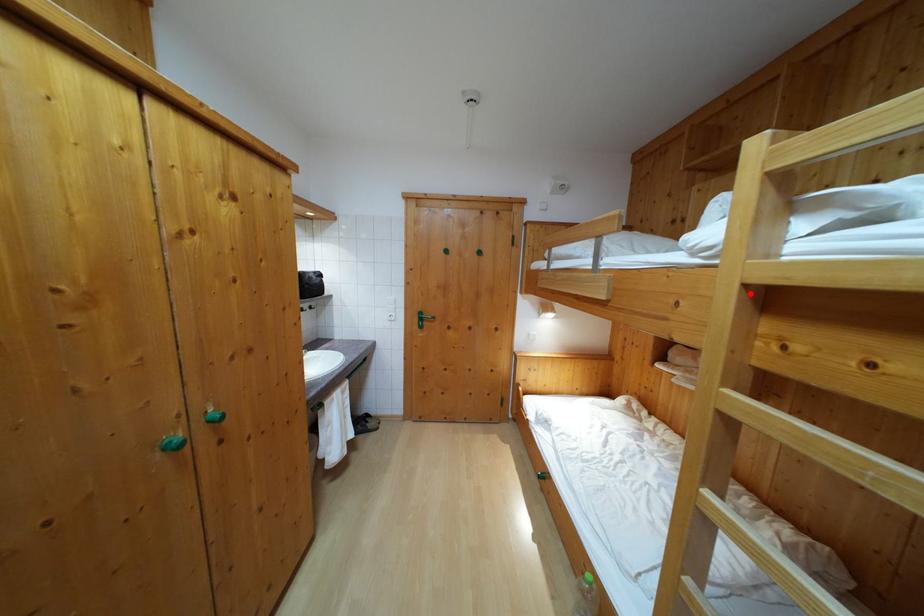
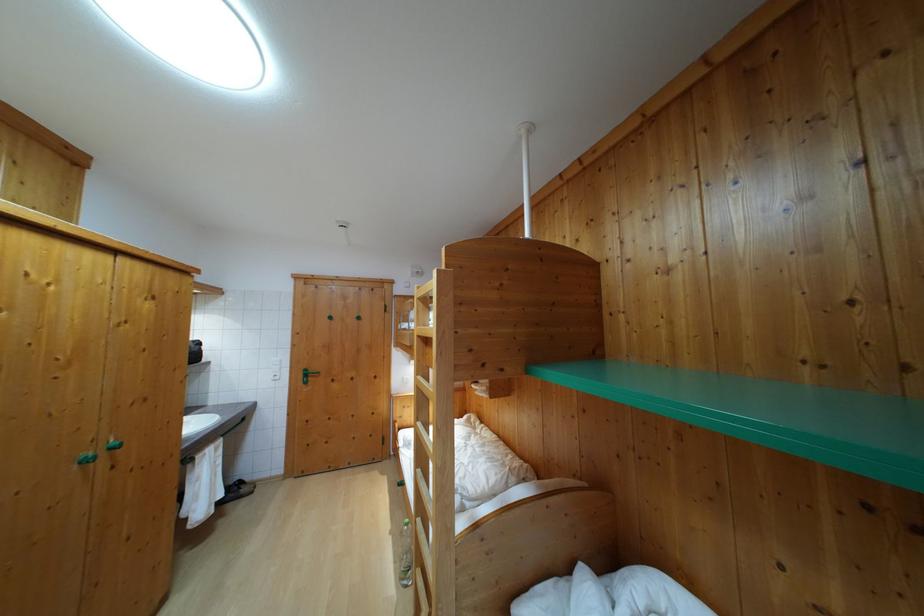
The point at the highlighted location is marked in the first image. Where is the corresponding point in the second image?

(421, 342)